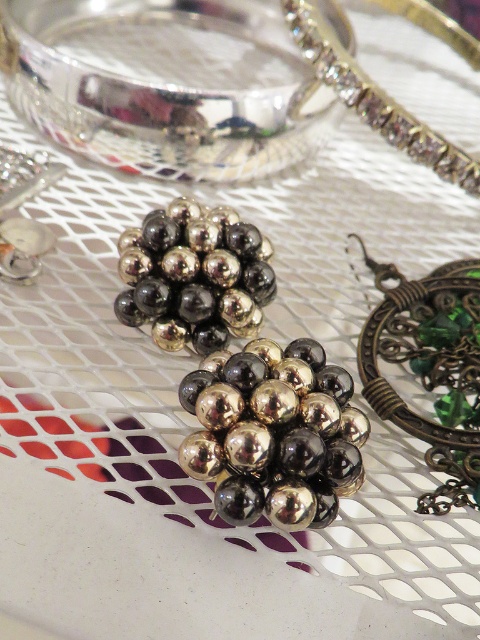
In the scene shown: You are a jeweler examining the jewelry pieces. You notice the green glass pendant at upper right and the shiny silver bracelet at upper right. Which one is wider?

The green glass pendant at upper right has a lesser width compared to the shiny silver bracelet at upper right, so the shiny silver bracelet at upper right is wider.